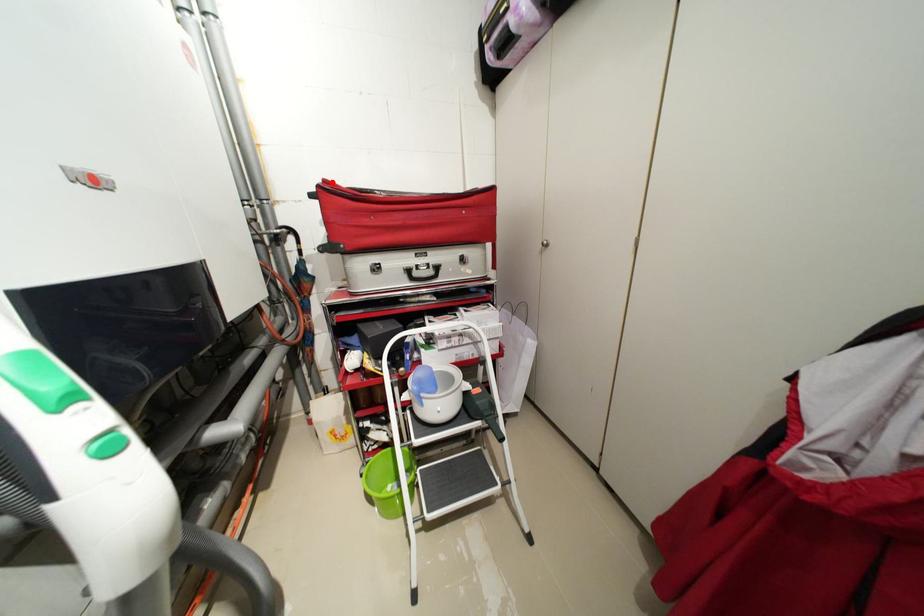
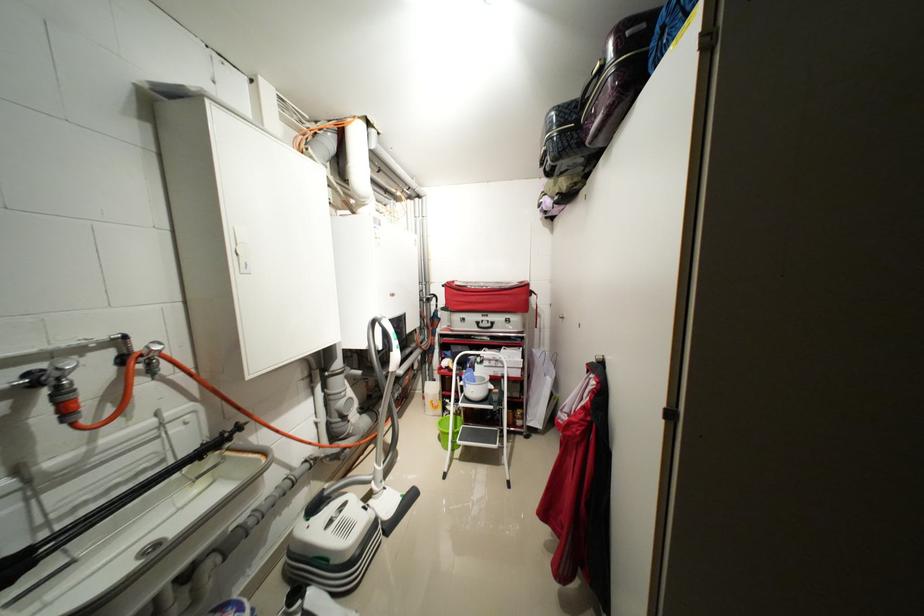
Locate, in the second image, the point that corresponds to the highlighted location in the first image.

(455, 284)